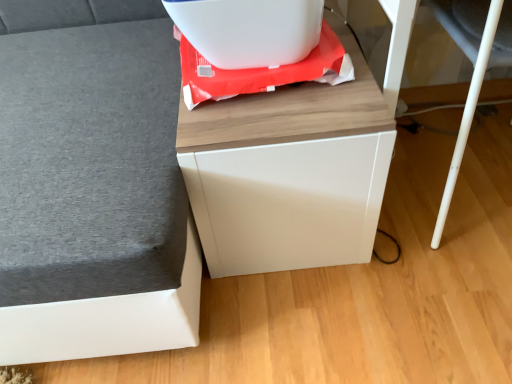
Question: In terms of width, does white plastic container at upper center look wider or thinner when compared to matte gray sofa at left, the second furniture positioned from the right?

Choices:
 (A) thin
 (B) wide

Answer: (A)

Question: From a real-world perspective, is white plastic container at upper center physically located above or below matte gray sofa at left, the first furniture positioned from the left?

Choices:
 (A) below
 (B) above

Answer: (B)

Question: Which of these objects is positioned closest to the white plastic container at upper center?

Choices:
 (A) matte gray sofa at left, the second furniture positioned from the right
 (B) white glossy cabinet at center, which appears as the second furniture when viewed from the left
 (C) white plastic swivel chair at lower right

Answer: (B)

Question: Which object is positioned farthest from the white plastic container at upper center?

Choices:
 (A) white glossy cabinet at center, which appears as the second furniture when viewed from the left
 (B) matte gray sofa at left, the second furniture positioned from the right
 (C) white plastic swivel chair at lower right

Answer: (C)